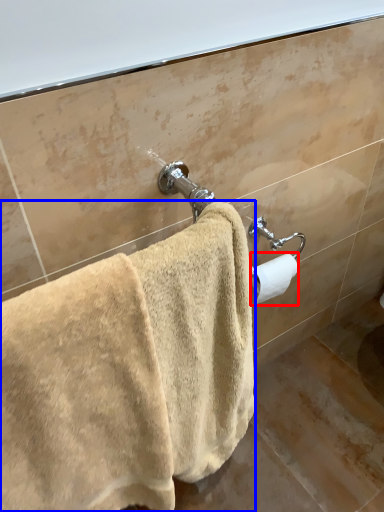
Question: Which object is further to the camera taking this photo, toilet paper (highlighted by a red box) or towel (highlighted by a blue box)?

Choices:
 (A) toilet paper
 (B) towel

Answer: (A)